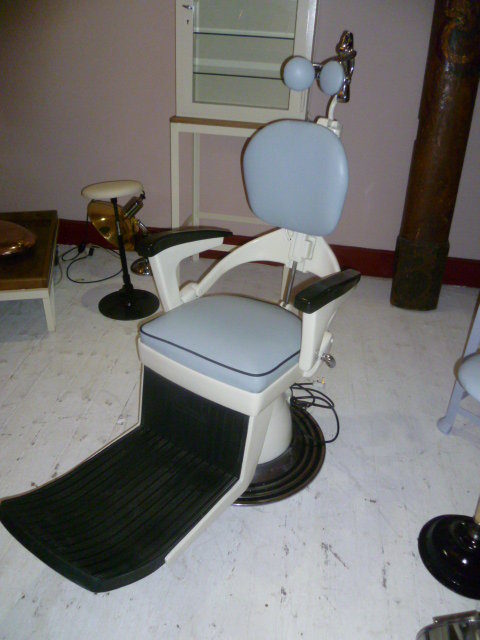
The image size is (480, 640). Identify the location of pillar. (439, 176).